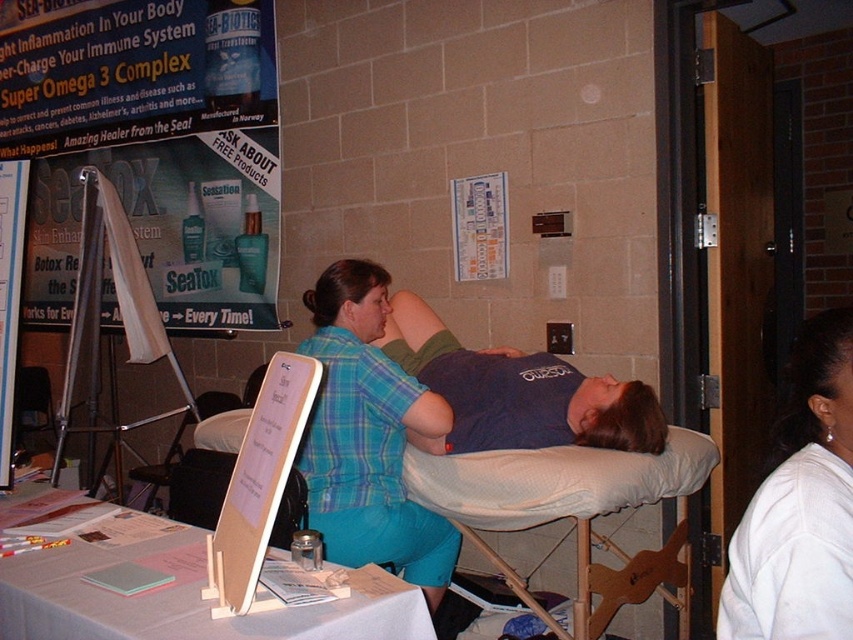
You are standing at the health booth and want to reach the point marked at coordinates (x=392, y=461). If your arm can extend 2 meters, can you reach that point without moving your feet?

The distance between you and the point (x=392, y=461) is 2.37 meters. Since your arm can only extend 2 meters, you cannot reach it without moving your feet.

You are organizing a health fair and need to decide which shirt to use for promotional materials. The plaid shirt at center and the blue cotton shirt at center are both options. Based on their thickness, which one would be easier to photograph clearly?

The plaid shirt at center is thinner than the blue cotton shirt at center, so it would be easier to photograph clearly because thinner fabrics tend to have fewer wrinkles and smoother surfaces, making them easier to capture in high detail.